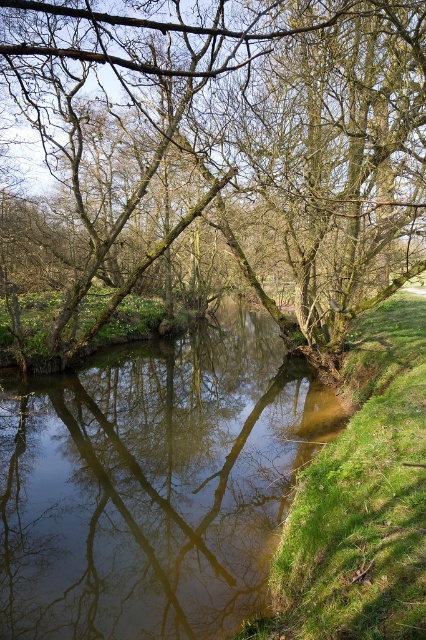
You are standing at the center of the image and want to walk towards the smooth bark tree at center. In which direction should you move to reach it?

The smooth bark tree at center is already at the center of the image, so you don not need to move in any direction to reach it.

You are standing on the riverbank and see the smooth bark tree at center and the clear water at center. Which object is positioned to the right side of the other?

The smooth bark tree at center is to the right of clear water at center.

You are standing at the edge of the river and want to reach the smooth bark tree at center and the clear water at center. Which one can you step on first as you walk towards them?

The smooth bark tree at center is closer to the viewer than the clear water at center, so you can step on the smooth bark tree at center first as you walk towards them.